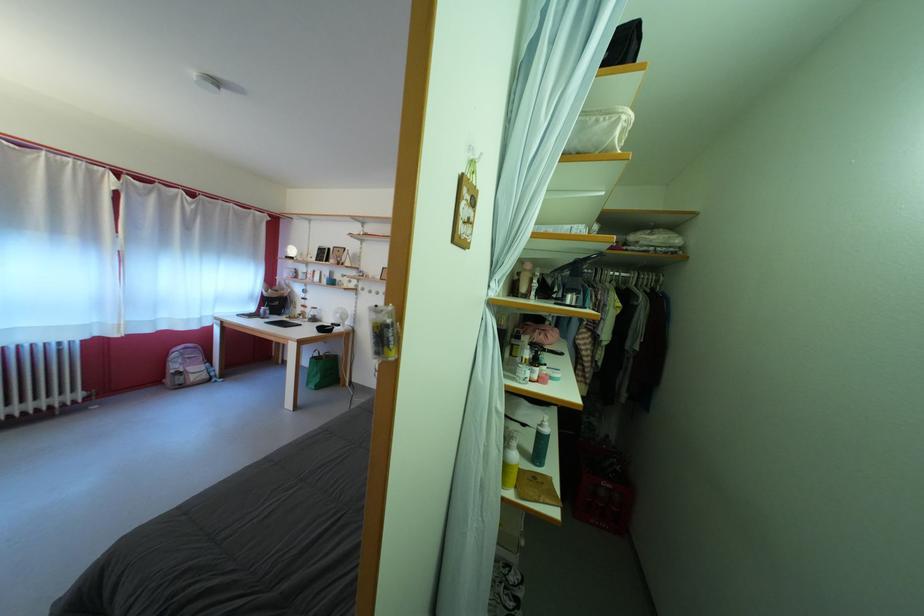
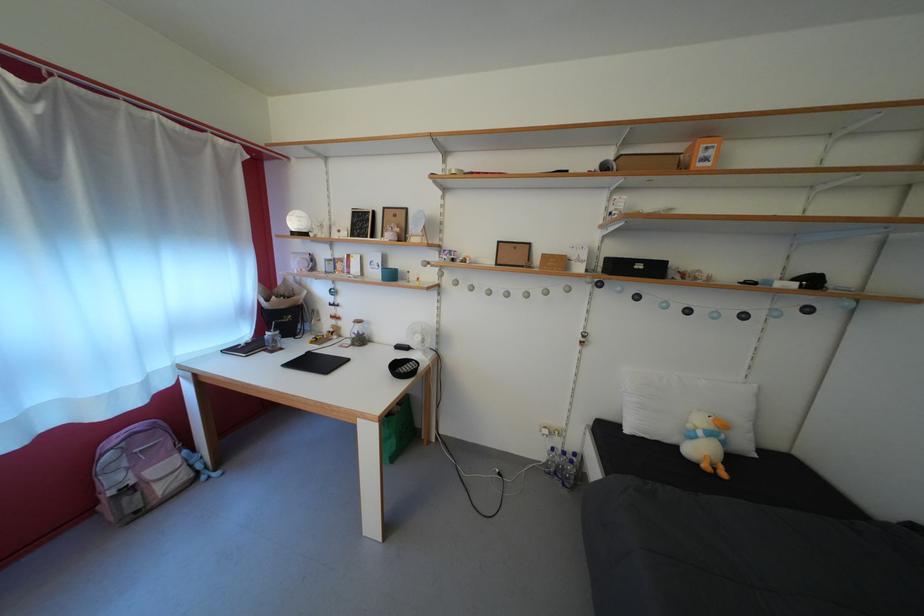
Find the pixel in the second image that matches (184,373) in the first image.

(123, 485)